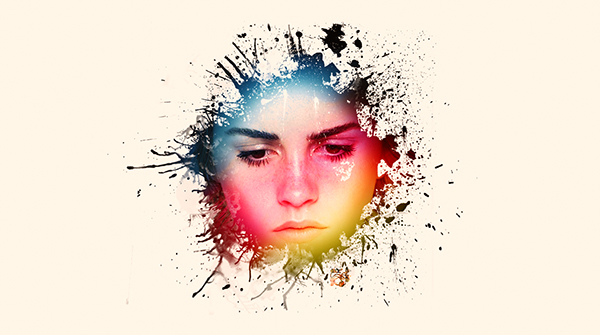
Where is `artworkl`? The height and width of the screenshot is (335, 600). artworkl is located at coordinates (348, 238).